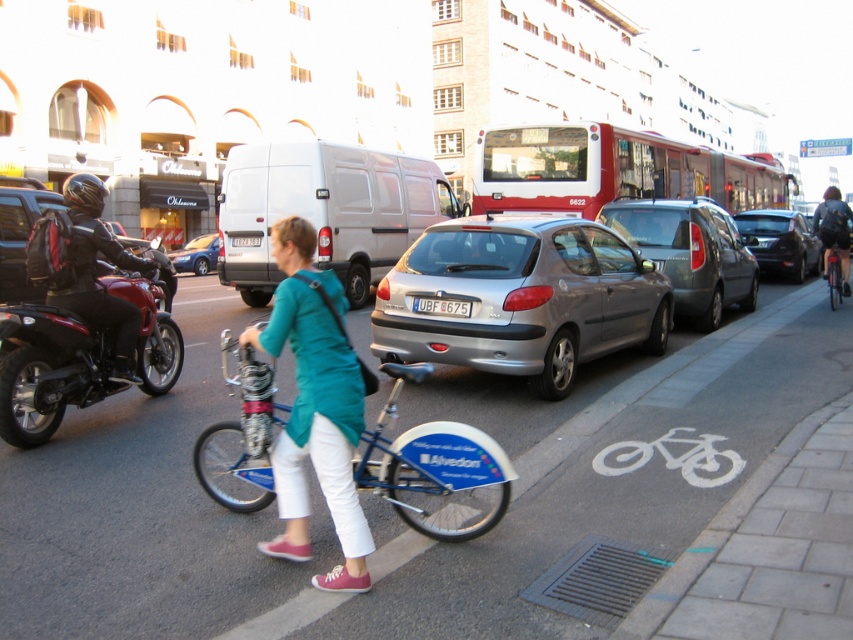
Question: Does silver metallic hatchback at center have a greater width compared to metallic silver hatchback at center?

Choices:
 (A) yes
 (B) no

Answer: (A)

Question: Which of these objects is positioned farthest from the blue metallic bike at center?

Choices:
 (A) metallic silver hatchback at center
 (B) teal fabric shirt at center
 (C) metallic blue bicycle at right

Answer: (A)

Question: Where is dark blue leather jacket at right located in relation to white plastic license plate at center in the image?

Choices:
 (A) right
 (B) left

Answer: (A)

Question: Which object appears closest to the camera in this image?

Choices:
 (A) blue metallic bike at center
 (B) satin silver car at center
 (C) blue metallic bicycle at center

Answer: (A)

Question: Which point appears closest to the camera in this image?

Choices:
 (A) (770, 186)
 (B) (198, 259)

Answer: (B)

Question: Where is blue metallic bike at center located in relation to metallic silver hatchback at center in the image?

Choices:
 (A) right
 (B) left

Answer: (A)